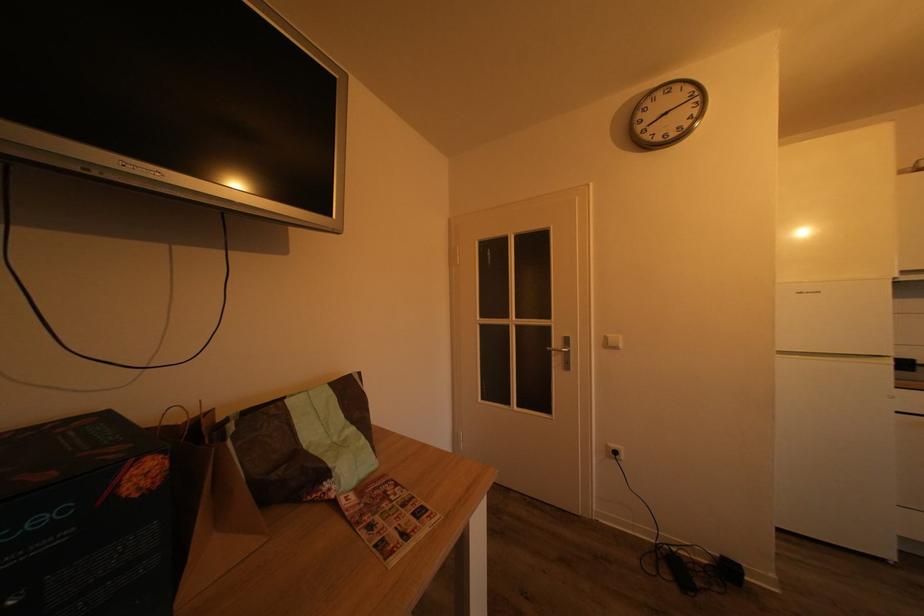
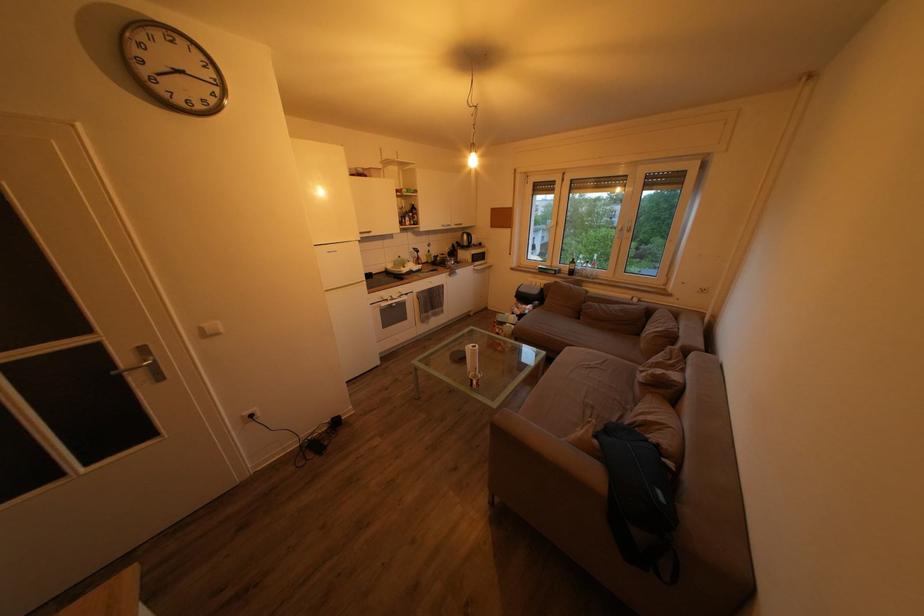
The point at (575, 347) is marked in the first image. Where is the corresponding point in the second image?

(151, 357)